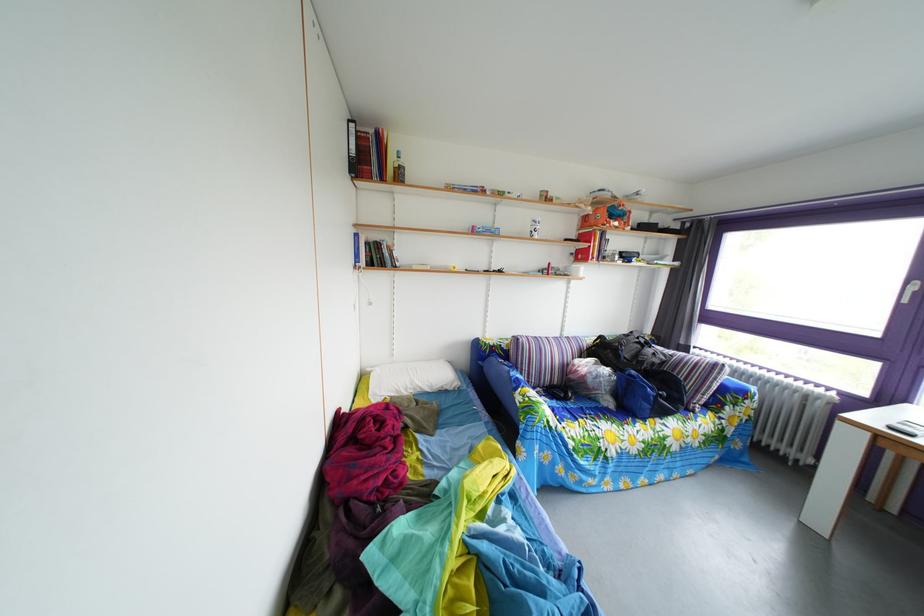
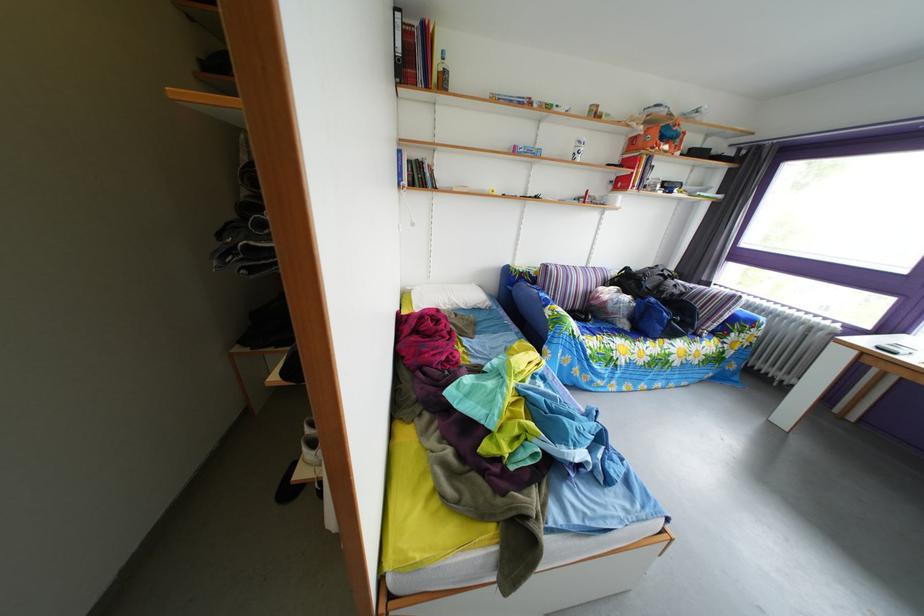
Find the pixel in the second image that matches (x=454, y=384) in the first image.

(485, 305)